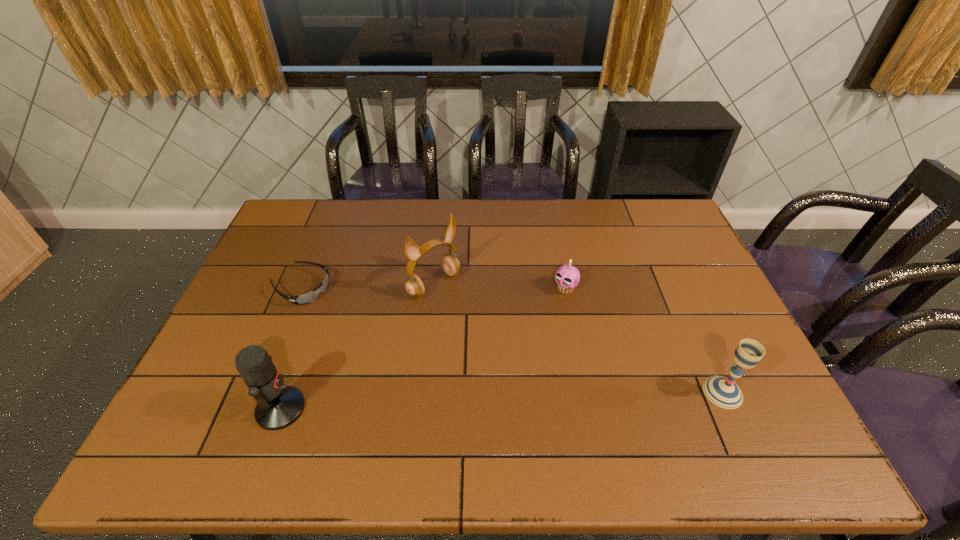
You are a GUI agent. You are given a task and a screenshot of the screen. Output one action in this format:
    pyautogui.click(x=<x>, y=<y>)
    Task: Click on the object that is at the left edge
    
    Given the screenshot: What is the action you would take?
    pyautogui.click(x=311, y=296)

Find the location of a particular element. This screenshot has width=960, height=540. object that is at the right edge is located at coordinates (724, 392).

Image resolution: width=960 pixels, height=540 pixels. I want to click on object present at the near right corner, so click(x=724, y=392).

Find the location of a particular element. vacant area at the far edge is located at coordinates (453, 201).

This screenshot has height=540, width=960. In the image, there is a desktop. What are the coordinates of `free space at the near edge` in the screenshot? It's located at (456, 413).

Identify the location of vacant region at the left edge of the desktop. Image resolution: width=960 pixels, height=540 pixels. (254, 291).

Locate an element on the screen. The height and width of the screenshot is (540, 960). free space at the right edge of the desktop is located at coordinates (730, 346).

This screenshot has width=960, height=540. I want to click on free location at the far left corner, so click(306, 228).

Image resolution: width=960 pixels, height=540 pixels. I want to click on free point between the sunglasses and the third tallest object, so click(512, 340).

I want to click on free space that is in between the shortest object and the chalice, so coord(512,340).